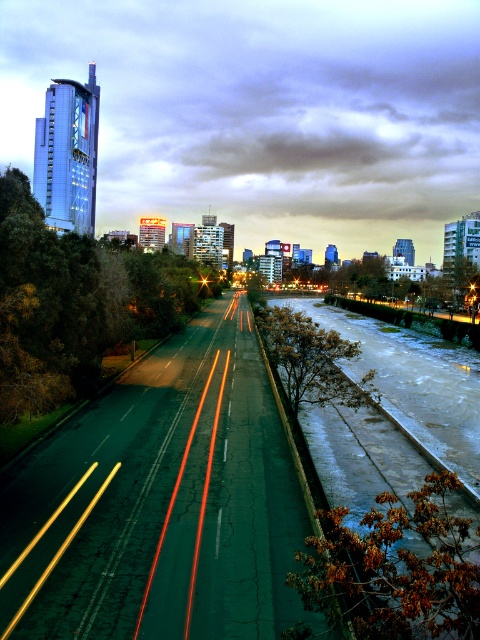
You are a photographer standing at the center of the road in the image. You want to place a marker at the point closer to you between point (106, 426) and point (468, 580). Which point should you choose?

Point (106, 426) is closer to you than point (468, 580), so you should choose point (106, 426).